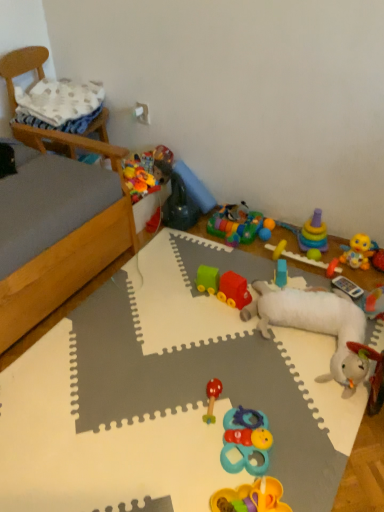
At what (x,y) coordinates should I click in order to perform the action: click on vacant area that lies between rubberized red mushroom at center, which is counted as the ninth toy, starting from the top, and white plush sheep at center, the 8th toy viewed from the top. Please return your answer as a coordinate pair (x, y). The image size is (384, 512). Looking at the image, I should click on (265, 376).